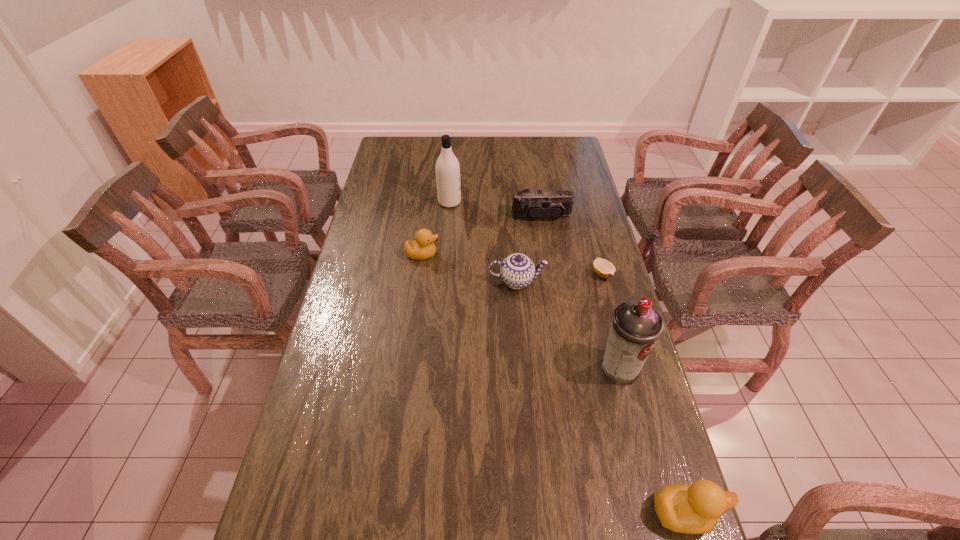
Locate an element on the screen. Image resolution: width=960 pixels, height=540 pixels. free space that satisfies the following two spatial constraints: 1. on the back side of the lemon; 2. on the right side of the second nearest object is located at coordinates (595, 274).

This screenshot has height=540, width=960. Find the location of `blank space that satisfies the following two spatial constraints: 1. on the front-facing side of the camcorder; 2. on the face of the left duckling`. blank space that satisfies the following two spatial constraints: 1. on the front-facing side of the camcorder; 2. on the face of the left duckling is located at coordinates (547, 254).